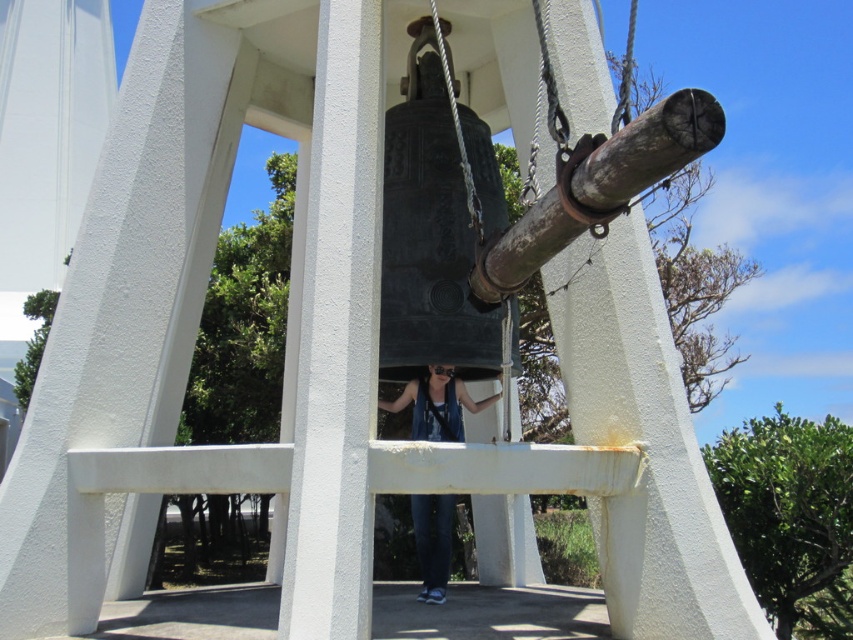
Question: Based on their relative distances, which object is nearer to the white smooth pillar at center?

Choices:
 (A) rusty metal cannon at center
 (B) blue denim jeans at center

Answer: (A)

Question: Which point appears closest to the camera in this image?

Choices:
 (A) (433, 548)
 (B) (345, 42)

Answer: (B)

Question: From the image, what is the correct spatial relationship of white smooth pillar at center in relation to blue denim jeans at center?

Choices:
 (A) below
 (B) above

Answer: (B)

Question: Among these objects, which one is nearest to the camera?

Choices:
 (A) blue denim jeans at center
 (B) rusty metal cannon at center
 (C) white smooth pillar at center

Answer: (B)

Question: Can you confirm if white smooth pillar at center is positioned to the left of rusty metal cannon at center?

Choices:
 (A) yes
 (B) no

Answer: (A)

Question: Can you confirm if white smooth pillar at center is smaller than blue denim jeans at center?

Choices:
 (A) yes
 (B) no

Answer: (B)